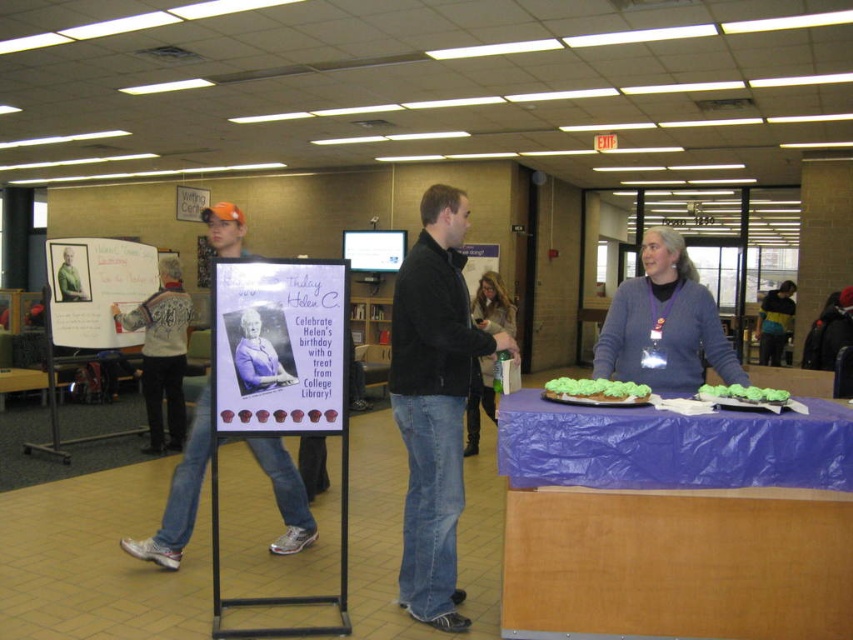
You are standing at point [294,378] and want to walk to point [177,534]. Which direction should you move?

Point [177,534] is behind point [294,378], so you should move backward to reach it.